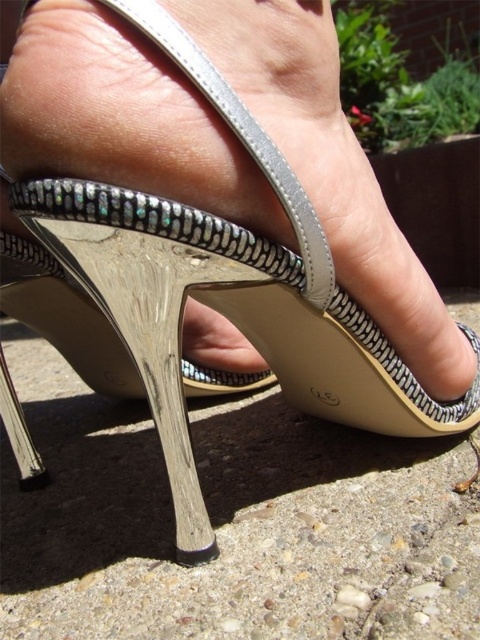
You are a photographer setting up a shoot on a textured concrete surface. You have a metallic leather sandal at center and smooth concrete at center in your frame. Which object in the frame takes up more space?

The smooth concrete at center is larger in size than the metallic leather sandal at center, so it takes up more space in the frame.

You are a photographer setting up a shoot. You have a metallic leather sandal at center and a smooth concrete at center in your scene. Which object is taller?

The metallic leather sandal at center is taller than the smooth concrete at center.

In the scene shown: You are standing on a textured concrete surface with small pebbles and stones. You notice a specific point marked at coordinates point (229,522). According to the image, what material is present at that point?

The point (229,522) corresponds to smooth concrete at center.